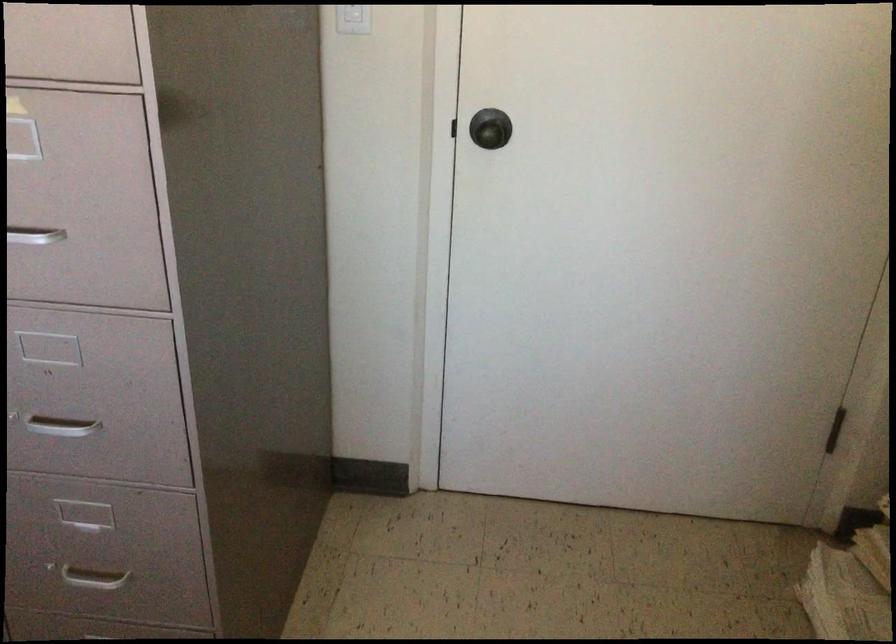
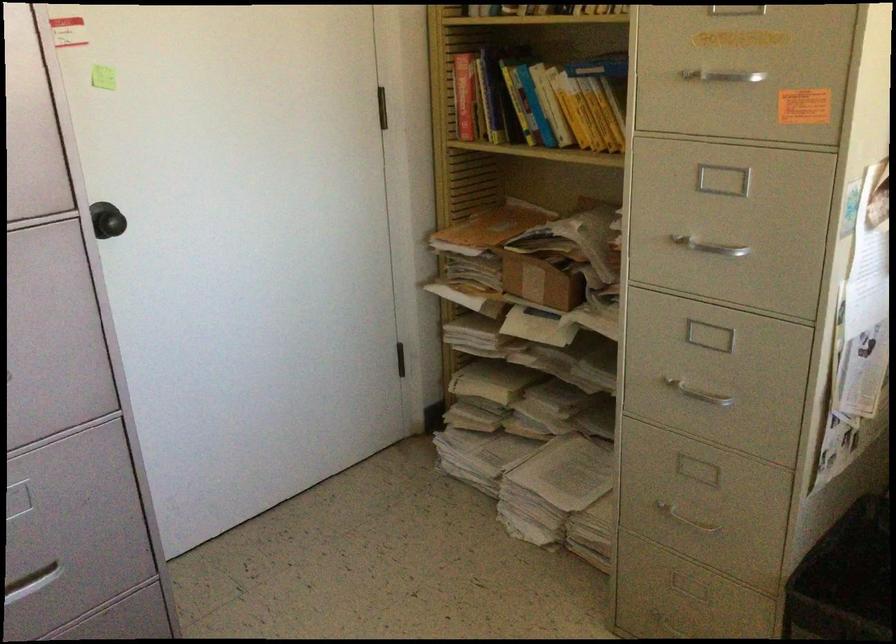
Question: I am providing you with two images of the same scene from different viewpoints. Which of the following objects are not visible in image2?

Choices:
 (A) small cardboard box
 (B) black doorknob
 (C) yellow book
 (D) none of these

Answer: (D)